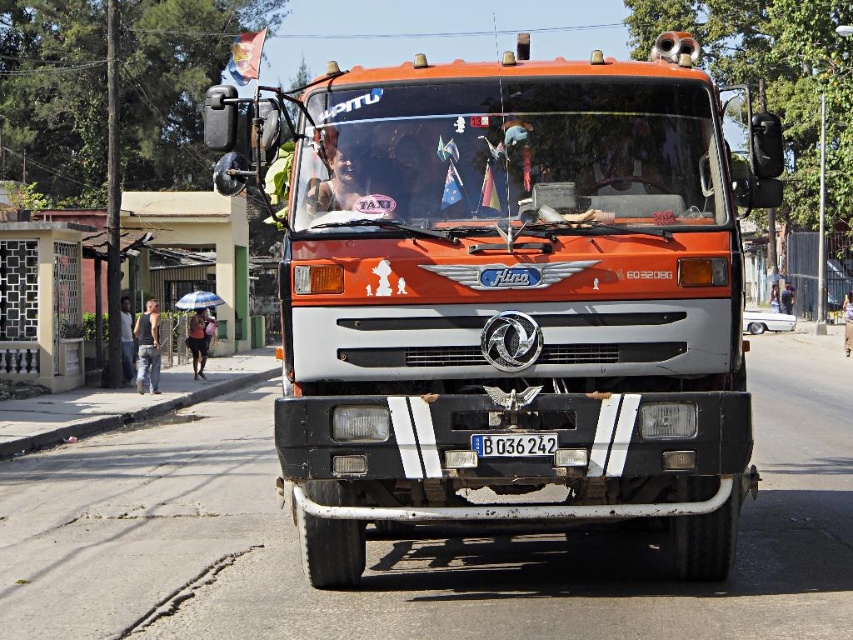
Does orange matte truck at center have a smaller size compared to denim pants at left?

Actually, orange matte truck at center might be larger than denim pants at left.

Is orange matte truck at center closer to the viewer compared to denim pants at left?

Yes, it is in front of denim pants at left.

Which is in front, point (668, 72) or point (126, 332)?

Positioned in front is point (668, 72).

The height and width of the screenshot is (640, 853). Identify the location of orange matte truck at center. (514, 300).

Is the position of matte plastic face at center less distant than that of denim pants at left?

Yes, it is in front of denim pants at left.

Does matte plastic face at center appear on the left side of denim pants at left?

Incorrect, matte plastic face at center is not on the left side of denim pants at left.

Between point (403, 193) and point (131, 340), which one is positioned behind?

Positioned behind is point (131, 340).

At what (x,y) coordinates should I click in order to perform the action: click on matte plastic face at center. Please return your answer as a coordinate pair (x, y). Looking at the image, I should click on (416, 173).

Is orange matte truck at center to the right of matte plastic face at center from the viewer's perspective?

Incorrect, orange matte truck at center is not on the right side of matte plastic face at center.

Is the position of orange matte truck at center more distant than that of matte plastic face at center?

No.

Find the location of a particular element. orange matte truck at center is located at coordinates (514, 300).